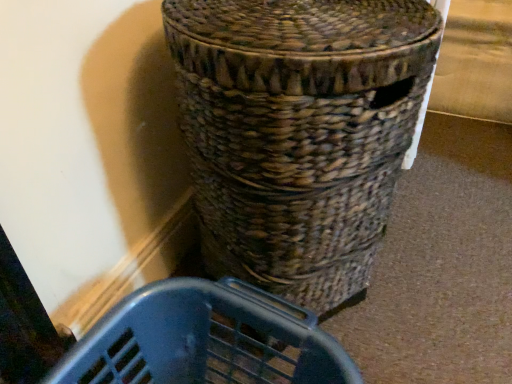
The width and height of the screenshot is (512, 384). What do you see at coordinates (298, 132) in the screenshot?
I see `woven brown basket at center` at bounding box center [298, 132].

Image resolution: width=512 pixels, height=384 pixels. In order to click on woven brown basket at center in this screenshot , I will do `click(298, 132)`.

You are a GUI agent. You are given a task and a screenshot of the screen. Output one action in this format:
    pyautogui.click(x=<x>, y=<y>)
    Task: Click on the blue plastic laundry basket at lower center
    The image size is (512, 384).
    Given the screenshot: What is the action you would take?
    pyautogui.click(x=205, y=340)

Describe the element at coordinates (205, 340) in the screenshot. I see `blue plastic laundry basket at lower center` at that location.

You are a GUI agent. You are given a task and a screenshot of the screen. Output one action in this format:
    pyautogui.click(x=<x>, y=<y>)
    Task: Click on the woven brown basket at center
    
    Given the screenshot: What is the action you would take?
    pyautogui.click(x=298, y=132)

Based on the photo, does blue plastic laundry basket at lower center appear on the right side of woven brown basket at center?

No.

Is blue plastic laundry basket at lower center in front of or behind woven brown basket at center in the image?

blue plastic laundry basket at lower center is positioned farther from the viewer than woven brown basket at center.

Which is nearer, (295,374) or (233,169)?

Point (295,374) is farther from the camera than point (233,169).

From the image's perspective, is blue plastic laundry basket at lower center below woven brown basket at center?

Yes, from the image's perspective, blue plastic laundry basket at lower center is beneath woven brown basket at center.

From a real-world perspective, does blue plastic laundry basket at lower center sit lower than woven brown basket at center?

Yes.

Does blue plastic laundry basket at lower center have a lesser width compared to woven brown basket at center?

Yes, blue plastic laundry basket at lower center is thinner than woven brown basket at center.

Is blue plastic laundry basket at lower center shorter than woven brown basket at center?

Yes, blue plastic laundry basket at lower center is shorter than woven brown basket at center.

Which of these two, blue plastic laundry basket at lower center or woven brown basket at center, is smaller?

Smaller between the two is blue plastic laundry basket at lower center.

Is blue plastic laundry basket at lower center situated inside woven brown basket at center or outside?

blue plastic laundry basket at lower center cannot be found inside woven brown basket at center.

Are blue plastic laundry basket at lower center and woven brown basket at center far apart?

They are positioned close to each other.

Is blue plastic laundry basket at lower center facing towards woven brown basket at center?

No, blue plastic laundry basket at lower center is not oriented towards woven brown basket at center.

How many degrees apart are the facing directions of blue plastic laundry basket at lower center and woven brown basket at center?

23.1 degrees separate the facing orientations of blue plastic laundry basket at lower center and woven brown basket at center.

Locate an element on the screen. The width and height of the screenshot is (512, 384). waste container above the blue plastic laundry basket at lower center (from a real-world perspective) is located at coordinates (298, 132).

Does woven brown basket at center appear on the left side of blue plastic laundry basket at lower center?

Incorrect, woven brown basket at center is not on the left side of blue plastic laundry basket at lower center.

Considering the positions of objects woven brown basket at center and blue plastic laundry basket at lower center in the image provided, who is in front, woven brown basket at center or blue plastic laundry basket at lower center?

woven brown basket at center is closer to the camera.

Does point (222, 186) appear closer or farther from the camera than point (301, 318)?

Point (222, 186).

From the image's perspective, between woven brown basket at center and blue plastic laundry basket at lower center, who is located below?

blue plastic laundry basket at lower center, from the image's perspective.

From a real-world perspective, does woven brown basket at center stand above blue plastic laundry basket at lower center?

Yes.

Which of these two, woven brown basket at center or blue plastic laundry basket at lower center, is thinner?

blue plastic laundry basket at lower center.

Does woven brown basket at center have a greater height compared to blue plastic laundry basket at lower center?

Yes.

Between woven brown basket at center and blue plastic laundry basket at lower center, which one has larger size?

woven brown basket at center.

Is blue plastic laundry basket at lower center inside woven brown basket at center?

Definitely not — blue plastic laundry basket at lower center is not inside woven brown basket at center.

Are woven brown basket at center and blue plastic laundry basket at lower center located far from each other?

No, woven brown basket at center is not far away from blue plastic laundry basket at lower center.

Could you tell me if woven brown basket at center is turned towards blue plastic laundry basket at lower center?

No.

How different are the orientations of woven brown basket at center and blue plastic laundry basket at lower center in degrees?

23.1 degrees separate the facing orientations of woven brown basket at center and blue plastic laundry basket at lower center.

Measure the distance from woven brown basket at center to blue plastic laundry basket at lower center.

woven brown basket at center is 8.78 inches away from blue plastic laundry basket at lower center.

In the image, there is a woven brown basket at center. Where is `basket container below it (from a real-world perspective)`? This screenshot has width=512, height=384. basket container below it (from a real-world perspective) is located at coordinates (205, 340).

In order to click on basket container behind the woven brown basket at center in this screenshot , I will do `click(205, 340)`.

You are a GUI agent. You are given a task and a screenshot of the screen. Output one action in this format:
    pyautogui.click(x=<x>, y=<y>)
    Task: Click on the basket container below the woven brown basket at center (from the image's perspective)
    Image resolution: width=512 pixels, height=384 pixels.
    Given the screenshot: What is the action you would take?
    pyautogui.click(x=205, y=340)